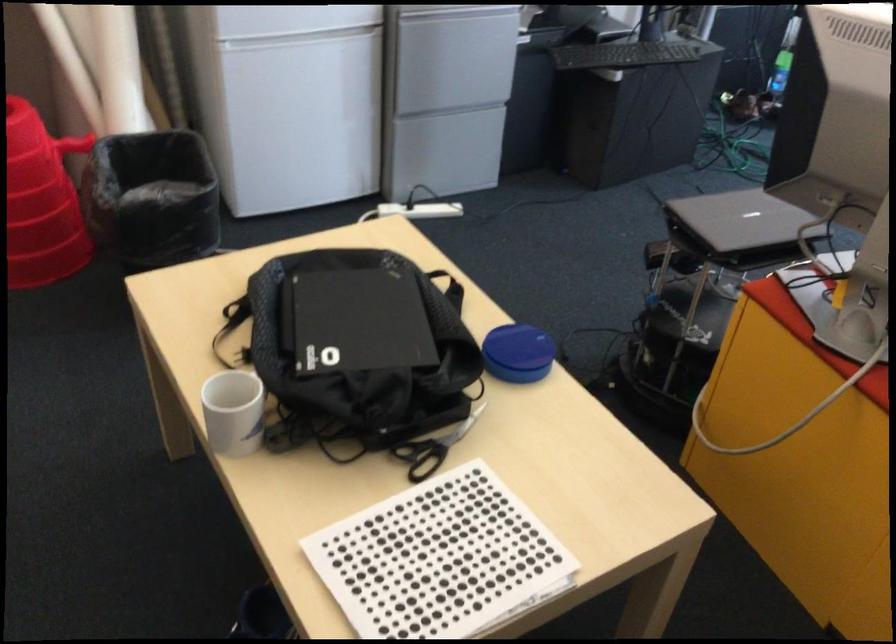
Find the location of `red plastic cone`. red plastic cone is located at coordinates (40, 202).